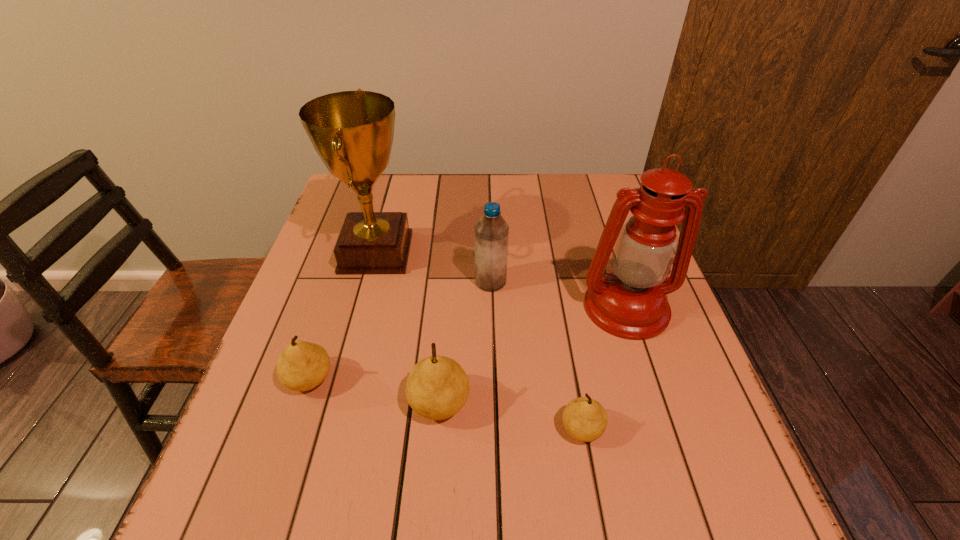
Please point a free position for a pear on the right. Please provide its 2D coordinates. Your answer should be formatted as a tuple, i.e. [(x, y)], where the tuple contains the x and y coordinates of a point satisfying the conditions above.

[(739, 457)]